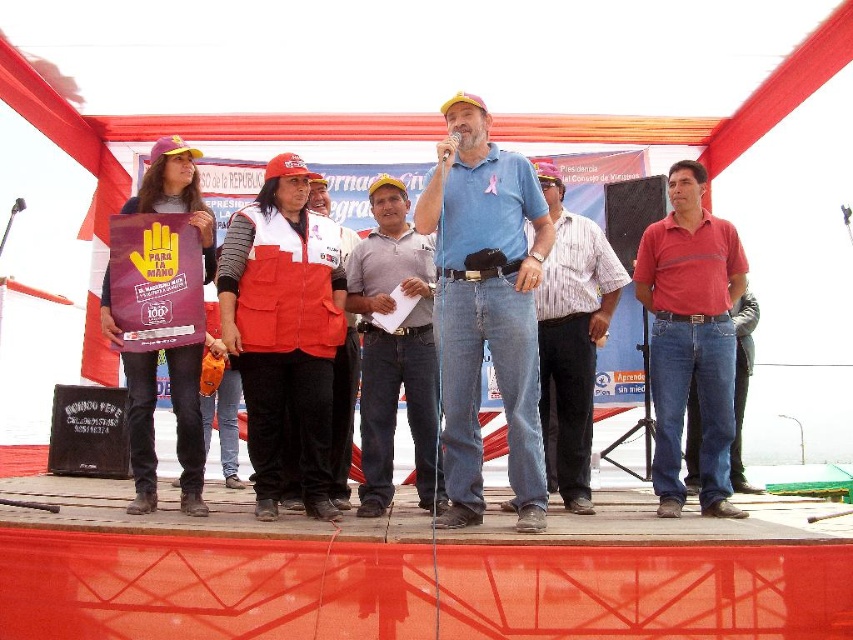
You are a photographer trying to capture both the striped cotton shirt at center and the denim jacket at left in the same frame. Given their sizes, which one should you focus on to ensure both are clearly visible?

The striped cotton shirt at center is larger than the denim jacket at left, so focusing on the striped cotton shirt at center would allow both to be clearly visible in the frame.

You are a photographer trying to capture a photo of the red cotton shirt at right and the gray cotton shirt at center. Which one is on the right side of the other?

The red cotton shirt at right is positioned on the right side of gray cotton shirt at center.

You are an event photographer positioned at the back of the stage. You need to capture a photo that includes both the red fabric vest at center and the red cotton shirt at right. Based on their positions, which one should you adjust your camera angle to focus on first to ensure both are in frame?

The red fabric vest at center is to the left of the red cotton shirt at right. To include both in the frame, focus on the red fabric vest at center first as it is closer to the left side, then adjust the angle to include the red cotton shirt at right on the right side.